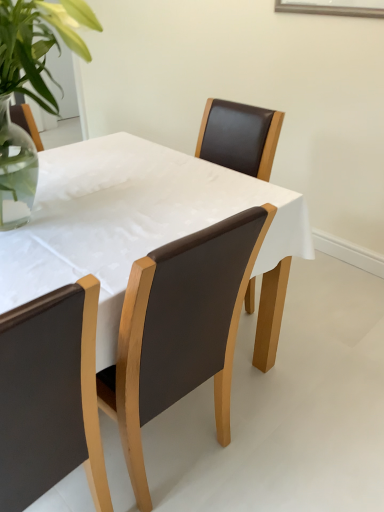
This screenshot has height=512, width=384. Describe the element at coordinates (130, 220) in the screenshot. I see `matte brown table at center` at that location.

Where is `brown leather chair at center, the 2th chair in the left-to-right sequence`? The image size is (384, 512). brown leather chair at center, the 2th chair in the left-to-right sequence is located at coordinates (180, 330).

In order to click on matte black chair at lower left, the 2th chair when ordered from right to left in this screenshot , I will do `click(50, 396)`.

In the image, there is a matte black chair at lower left, the 2th chair when ordered from right to left. Where is `chair below it (from a real-world perspective)`? chair below it (from a real-world perspective) is located at coordinates (180, 330).

In the scene shown: Does brown leather chair at center, the 2th chair in the left-to-right sequence, have a lesser height compared to matte black chair at lower left, the 2th chair when ordered from right to left?

Yes.

Is brown leather chair at center, acting as the 1th chair starting from the right, not near matte black chair at lower left, the 2th chair when ordered from right to left?

No, brown leather chair at center, acting as the 1th chair starting from the right, is in close proximity to matte black chair at lower left, the 2th chair when ordered from right to left.

From a real-world perspective, relative to matte brown table at center, is brown leather chair at center, acting as the 1th chair starting from the right, vertically above or below?

Clearly, from a real-world perspective, brown leather chair at center, acting as the 1th chair starting from the right, is above matte brown table at center.

Which object is positioned more to the right, brown leather chair at center, acting as the 1th chair starting from the right, or matte brown table at center?

brown leather chair at center, acting as the 1th chair starting from the right.

How distant is brown leather chair at center, the 2th chair in the left-to-right sequence, from matte brown table at center?

brown leather chair at center, the 2th chair in the left-to-right sequence, is 12.65 inches away from matte brown table at center.

Consider the image. Visually, is matte black chair at lower left, the 2th chair when ordered from right to left, positioned to the left or to the right of matte brown table at center?

In the image, matte black chair at lower left, the 2th chair when ordered from right to left, appears on the left side of matte brown table at center.

Consider the image. Could you tell me if matte black chair at lower left, the 2th chair when ordered from right to left, is turned towards matte brown table at center?

Yes.

Relative to matte brown table at center, is matte black chair at lower left, the 2th chair when ordered from right to left, in front or behind?

Visually, matte black chair at lower left, the 2th chair when ordered from right to left, is located in front of matte brown table at center.

Which of these two, matte black chair at lower left, the 2th chair when ordered from right to left, or matte brown table at center, is wider?

With larger width is matte brown table at center.

Considering the points (8, 394) and (142, 451), which point is behind, point (8, 394) or point (142, 451)?

The point (142, 451) is farther from the camera.

Could you tell me if matte black chair at lower left, the 2th chair when ordered from right to left, is facing brown leather chair at center, the 2th chair in the left-to-right sequence?

No, matte black chair at lower left, the 2th chair when ordered from right to left, does not turn towards brown leather chair at center, the 2th chair in the left-to-right sequence.

Which object is positioned more to the right, matte black chair at lower left, arranged as the first chair when viewed from the left, or brown leather chair at center, the 2th chair in the left-to-right sequence?

brown leather chair at center, the 2th chair in the left-to-right sequence, is more to the right.

Measure the distance from matte black chair at lower left, arranged as the first chair when viewed from the left, to brown leather chair at center, acting as the 1th chair starting from the right.

A distance of 7.83 inches exists between matte black chair at lower left, arranged as the first chair when viewed from the left, and brown leather chair at center, acting as the 1th chair starting from the right.

From a real-world perspective, who is located lower, matte brown table at center or brown leather chair at center, acting as the 1th chair starting from the right?

matte brown table at center, from a real-world perspective.

Considering the sizes of matte brown table at center and brown leather chair at center, acting as the 1th chair starting from the right, in the image, is matte brown table at center taller or shorter than brown leather chair at center, acting as the 1th chair starting from the right,?

matte brown table at center is shorter than brown leather chair at center, acting as the 1th chair starting from the right.

From the image's perspective, relative to brown leather chair at center, acting as the 1th chair starting from the right, is matte brown table at center above or below?

matte brown table at center is above brown leather chair at center, acting as the 1th chair starting from the right.

Is matte brown table at center positioned with its back to brown leather chair at center, acting as the 1th chair starting from the right?

Yes, matte brown table at center is facing away from brown leather chair at center, acting as the 1th chair starting from the right.

Could you measure the distance between matte brown table at center and matte black chair at lower left, the 2th chair when ordered from right to left?

matte brown table at center is 16.69 inches away from matte black chair at lower left, the 2th chair when ordered from right to left.

From the image's perspective, is matte brown table at center beneath matte black chair at lower left, arranged as the first chair when viewed from the left?

No.

In terms of height, does matte brown table at center look taller or shorter compared to matte black chair at lower left, arranged as the first chair when viewed from the left?

In the image, matte brown table at center appears to be shorter than matte black chair at lower left, arranged as the first chair when viewed from the left.

Looking at this image, is matte brown table at center in front of or behind matte black chair at lower left, the 2th chair when ordered from right to left, in the image?

matte brown table at center is behind matte black chair at lower left, the 2th chair when ordered from right to left.

Locate an element on the screen. chair located on the right of matte black chair at lower left, arranged as the first chair when viewed from the left is located at coordinates (180, 330).

The width and height of the screenshot is (384, 512). I want to click on chair behind the matte brown table at center, so click(x=180, y=330).

Based on their spatial positions, is brown leather chair at center, the 2th chair in the left-to-right sequence, or matte brown table at center closer to matte black chair at lower left, the 2th chair when ordered from right to left?

The object closer to matte black chair at lower left, the 2th chair when ordered from right to left, is brown leather chair at center, the 2th chair in the left-to-right sequence.

Looking at the image, which one is located further to brown leather chair at center, the 2th chair in the left-to-right sequence, matte brown table at center or matte black chair at lower left, arranged as the first chair when viewed from the left?

Among the two, matte brown table at center is located further to brown leather chair at center, the 2th chair in the left-to-right sequence.

Consider the image. From the image, which object appears to be farther from matte brown table at center, matte black chair at lower left, the 2th chair when ordered from right to left, or brown leather chair at center, acting as the 1th chair starting from the right?

The object further to matte brown table at center is matte black chair at lower left, the 2th chair when ordered from right to left.

Based on their spatial positions, is matte black chair at lower left, arranged as the first chair when viewed from the left, or matte brown table at center further from brown leather chair at center, the 2th chair in the left-to-right sequence?

matte brown table at center is further to brown leather chair at center, the 2th chair in the left-to-right sequence.

From the image, which object appears to be nearer to matte black chair at lower left, the 2th chair when ordered from right to left, matte brown table at center or brown leather chair at center, acting as the 1th chair starting from the right?

The object closer to matte black chair at lower left, the 2th chair when ordered from right to left, is brown leather chair at center, acting as the 1th chair starting from the right.

Based on their spatial positions, is brown leather chair at center, acting as the 1th chair starting from the right, or matte black chair at lower left, the 2th chair when ordered from right to left, closer to matte brown table at center?

brown leather chair at center, acting as the 1th chair starting from the right, lies closer to matte brown table at center than the other object.

Identify the location of kitchen & dining room table between matte black chair at lower left, the 2th chair when ordered from right to left, and brown leather chair at center, the 2th chair in the left-to-right sequence. The width and height of the screenshot is (384, 512). (130, 220).